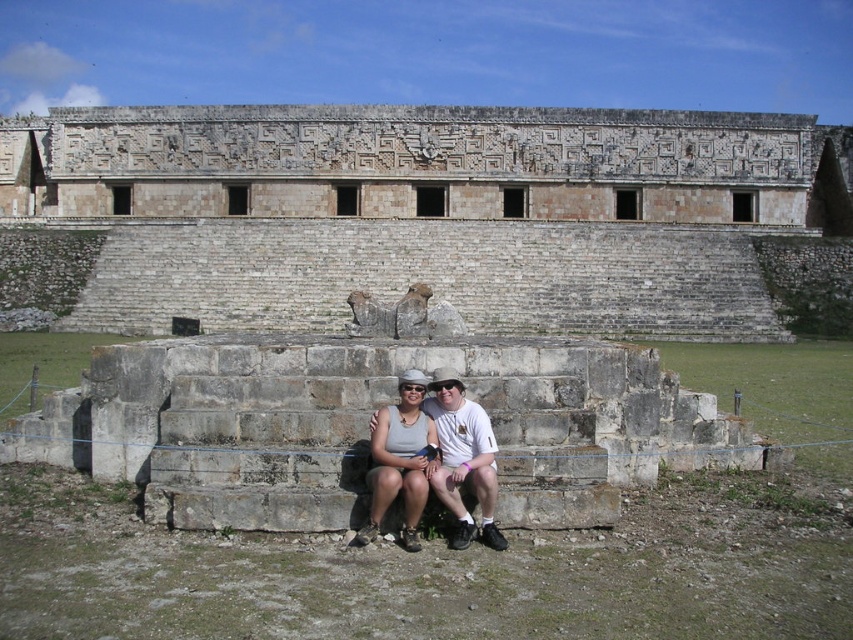
You are standing at the point labeled as point (x=422, y=214) in the image. What structure are you directly at?

You are directly at the stone amphitheater at center.

You are standing at point [450,424] and want to walk to point [494,118]. Given that the path between them is clear, which direction should you face to move towards your destination?

You should face north because point [494,118] is behind point [450,424], indicating it is in the northern direction.

What are the coordinates of the stone amphitheater at center?

The stone amphitheater at center is located at point (422, 214).